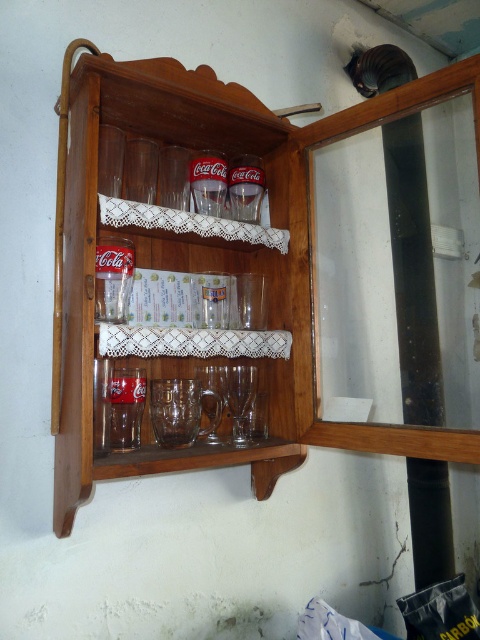
You are trying to place a new decorative item on the wooden cabinet at center. The item is as wide as the clear glass wine glass at center. Will it fit entirely on the cabinet?

The wooden cabinet at center might be wider than the clear glass wine glass at center, so the decorative item should fit, but there is some uncertainty because the comparison is not definitive.

Consider the image. You are a bartender preparing for a party and need to place a new clear glass on the wooden cabinet at center. Can you fit another clear glass wine glass at center on the cabinet without overlapping any existing items?

The wooden cabinet at center is larger in size than clear glass wine glass at center, so there should be enough space to place another clear glass wine glass at center on the cabinet without overlapping existing items.